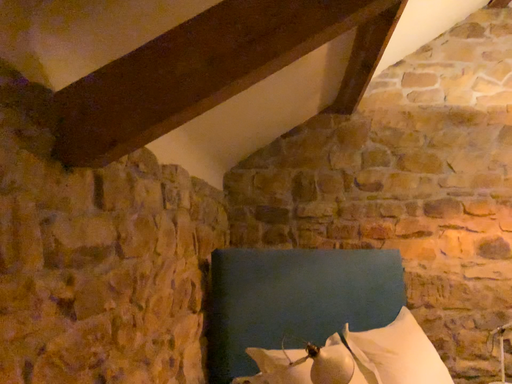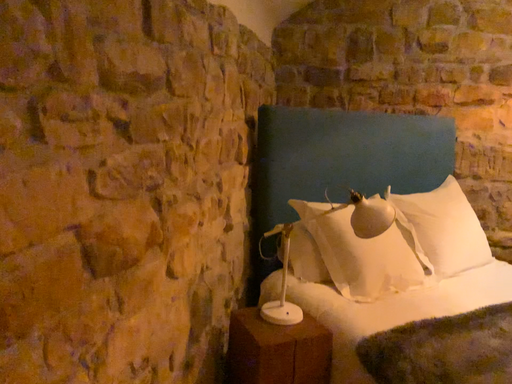
Question: Which way did the camera rotate in the video?

Choices:
 (A) rotated downward
 (B) rotated upward

Answer: (A)